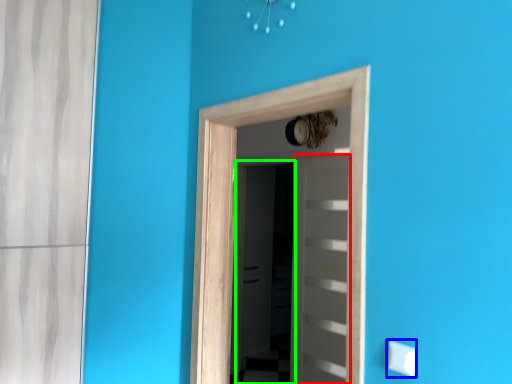
Question: Which object is positioned closest to door (highlighted by a red box)? Select from light switch (highlighted by a blue box) and screen door (highlighted by a green box).

Choices:
 (A) light switch
 (B) screen door

Answer: (B)